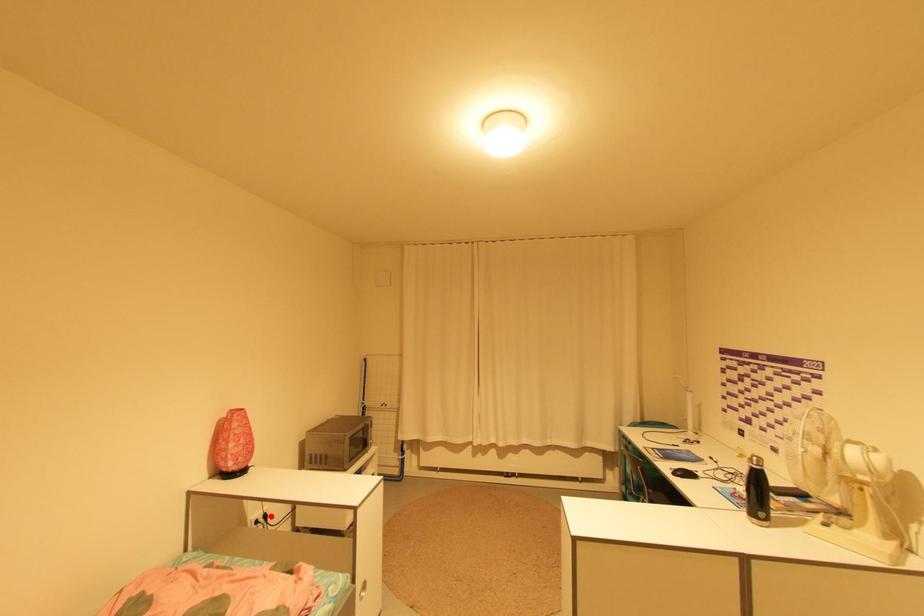
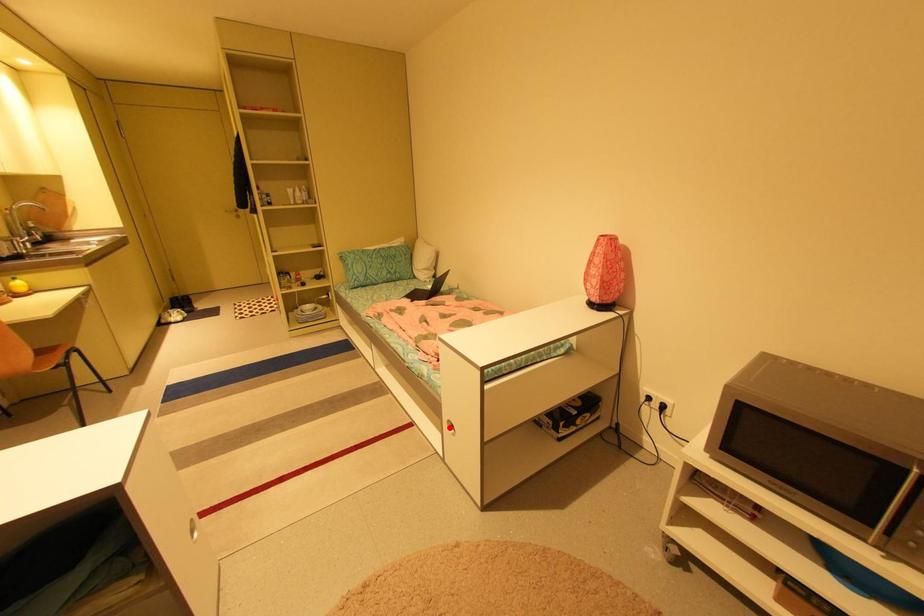
I am providing you with two images of the same scene from different viewpoints. A red point is marked on the first image and another point is marked on the second image. Do the highlighted points in image1 and image2 indicate the same real-world spot?

No